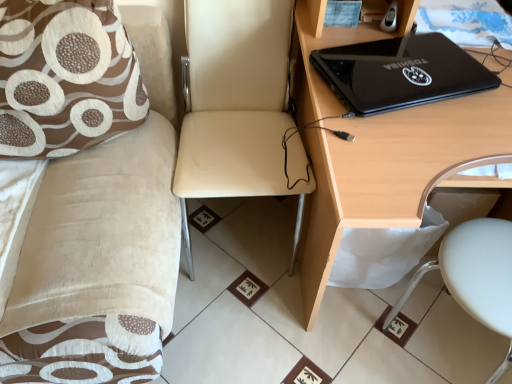
Find the location of `vacant space in beige leather chair at center (from a real-world perspective)`. vacant space in beige leather chair at center (from a real-world perspective) is located at coordinates (236, 232).